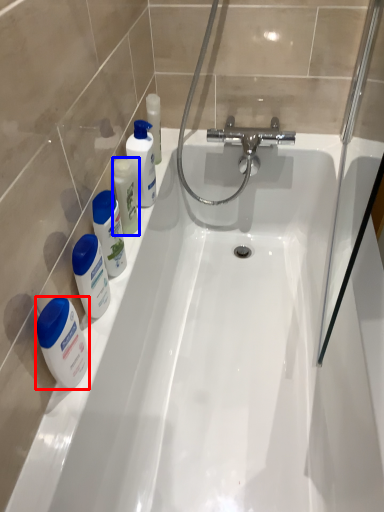
Question: Which point is further to the camera, mouthwash (highlighted by a red box) or mouthwash (highlighted by a blue box)?

Choices:
 (A) mouthwash
 (B) mouthwash

Answer: (B)